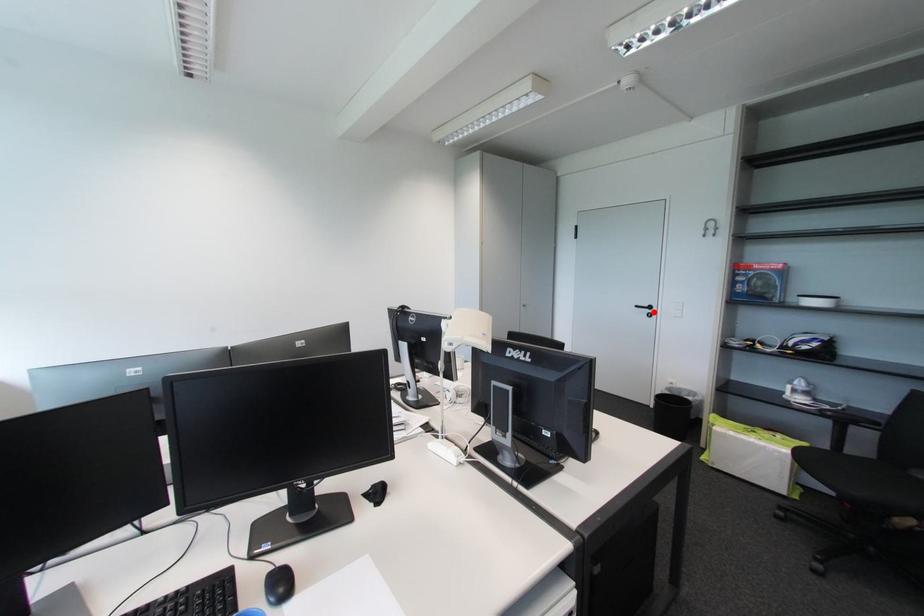
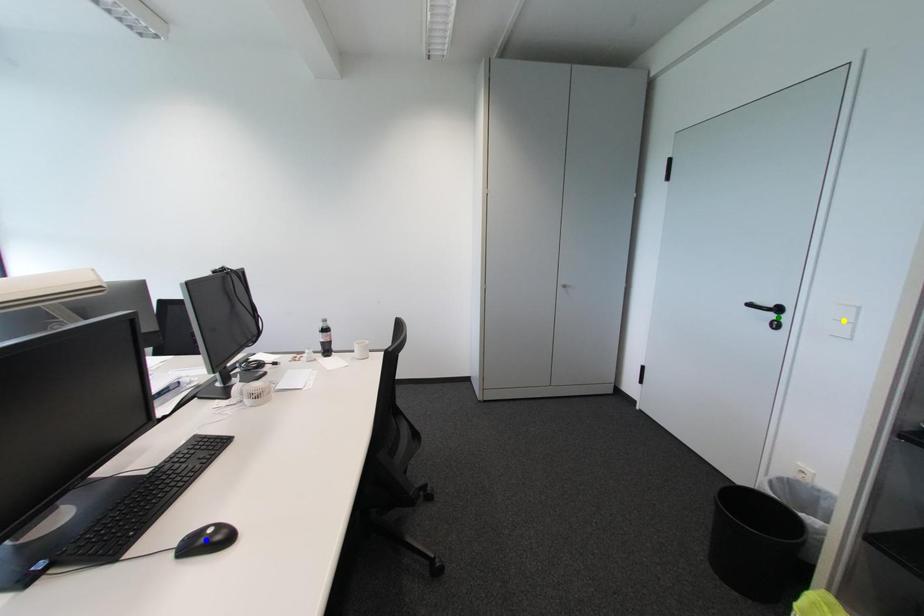
Question: I am providing you with two images of the same scene from different viewpoints. A red point is marked on the first image. You are given multiple points on the second image. Which spot in image 2 lines up with the point in image 1?

Choices:
 (A) yellow point
 (B) blue point
 (C) green point

Answer: (C)